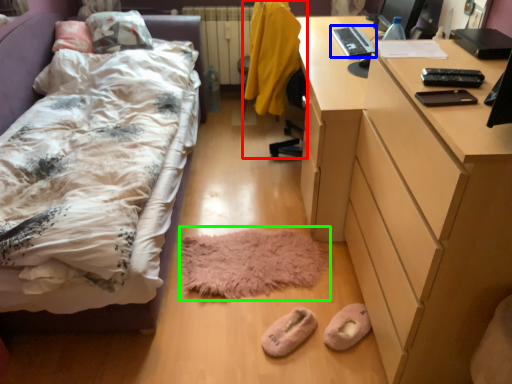
Question: Estimate the real-world distances between objects in this image. Which object is farther from swivel chair (highlighted by a red box), laptop (highlighted by a blue box) or mat (highlighted by a green box)?

Choices:
 (A) laptop
 (B) mat

Answer: (B)